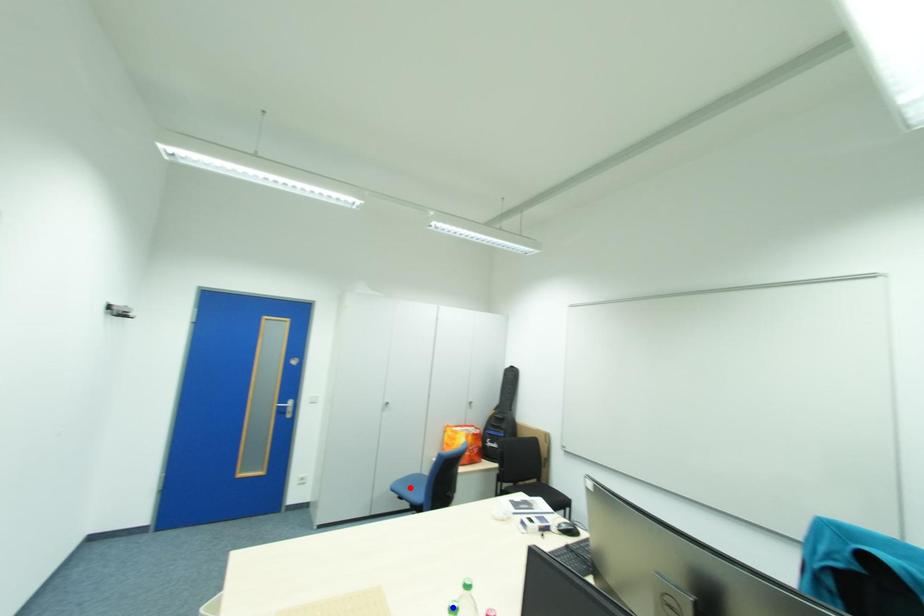
Question: Which of the two points in the image is closer to the camera?

Choices:
 (A) Blue point is closer.
 (B) Red point is closer.

Answer: (A)